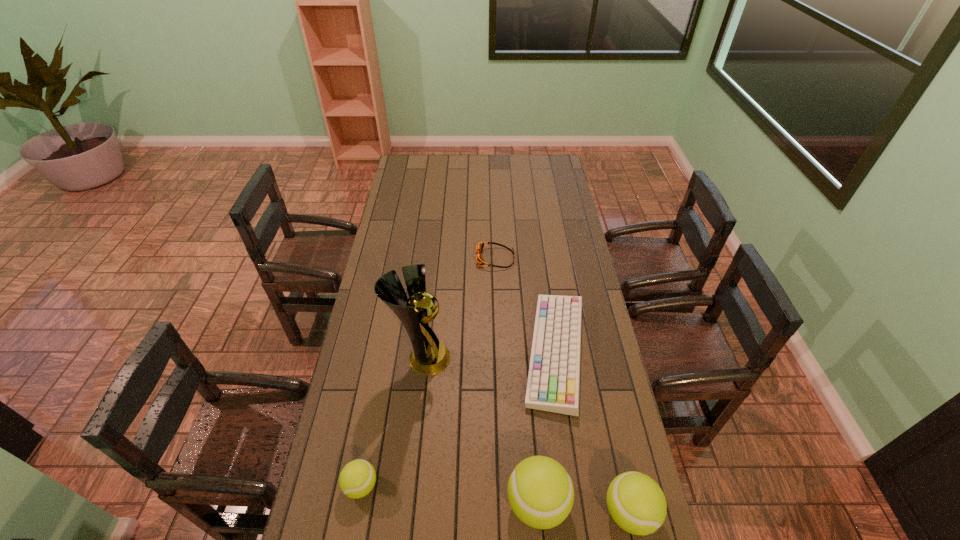
Locate an element on the screen. Image resolution: width=960 pixels, height=540 pixels. vacant space at the right edge of the desktop is located at coordinates (604, 422).

Identify the location of vacant position at the far left corner of the desktop. (409, 156).

The width and height of the screenshot is (960, 540). I want to click on unoccupied position between the fifth tallest object and the shortest tennis ball, so click(459, 419).

Identify the location of free point between the tallest object and the second tennis ball from left to right. The height and width of the screenshot is (540, 960). (480, 431).

Find the location of a particular element. vacant space that's between the leftmost tennis ball and the second tennis ball from right to left is located at coordinates (449, 495).

Where is `vacant space that is in between the award and the shortest object`? The image size is (960, 540). vacant space that is in between the award and the shortest object is located at coordinates [x=459, y=308].

Identify the location of free point between the farthest object and the computer keyboard. This screenshot has height=540, width=960. tap(526, 305).

Where is `object identified as the fourth closest to the tallest object`? This screenshot has width=960, height=540. object identified as the fourth closest to the tallest object is located at coordinates (479, 247).

Where is `object that stands as the fifth closest to the second tennis ball from left to right`? object that stands as the fifth closest to the second tennis ball from left to right is located at coordinates (479, 247).

Choose which tennis ball is the second nearest neighbor to the goggles. Please provide its 2D coordinates. Your answer should be formatted as a tuple, i.e. [(x, y)], where the tuple contains the x and y coordinates of a point satisfying the conditions above.

[(357, 479)]